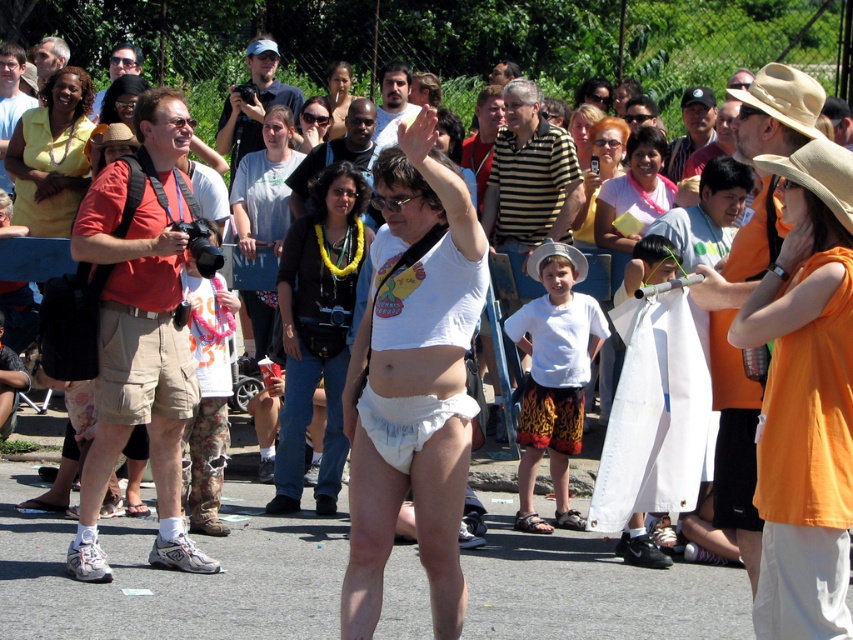
Question: Is matte black camera at center to the right of white fabric diaper at center from the viewer's perspective?

Choices:
 (A) no
 (B) yes

Answer: (A)

Question: Which of these objects is positioned farthest from the matte black shirt at center?

Choices:
 (A) orange cotton shirt at upper right
 (B) beige fabric cowboy hat at upper right
 (C) white cotton bikini top at center
 (D) yellow matte shirt at upper left

Answer: (A)

Question: Can you confirm if white fabric diaper at center is positioned to the right of matte yellow sunglasses at upper center?

Choices:
 (A) yes
 (B) no

Answer: (B)

Question: Which of the following is the farthest from the observer?

Choices:
 (A) matte yellow sunglasses at upper center
 (B) matte black shirt at center
 (C) white fabric cowboy hat at center
 (D) white cotton bikini top at center

Answer: (B)

Question: Which of the following is the farthest from the observer?

Choices:
 (A) white fabric diaper at center
 (B) matte black camera at center

Answer: (B)

Question: Is white cotton bikini top at center below tan fabric cowboy hat at upper right?

Choices:
 (A) yes
 (B) no

Answer: (A)